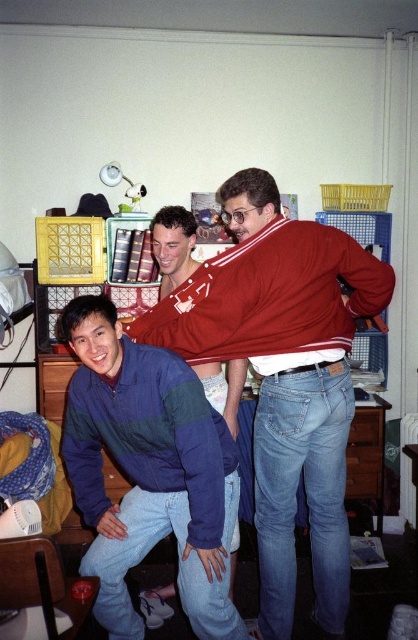
Question: Which of these objects is positioned closest to the wooden drawer at lower right?

Choices:
 (A) matte wood drawer at lower right
 (B) blue-green striped jacket at lower left

Answer: (A)

Question: Can you confirm if wooden drawer at lower right is smaller than matte wood drawer at lower right?

Choices:
 (A) yes
 (B) no

Answer: (B)

Question: Which point is closer to the camera?

Choices:
 (A) (361, 412)
 (B) (180, 289)

Answer: (B)

Question: Does wooden drawer at lower right appear over matte wood drawer at lower right?

Choices:
 (A) yes
 (B) no

Answer: (B)

Question: Is wooden drawer at lower right wider than matte wood drawer at lower right?

Choices:
 (A) yes
 (B) no

Answer: (A)

Question: Among these points, which one is nearest to the camera?

Choices:
 (A) (89, 515)
 (B) (359, 490)

Answer: (A)